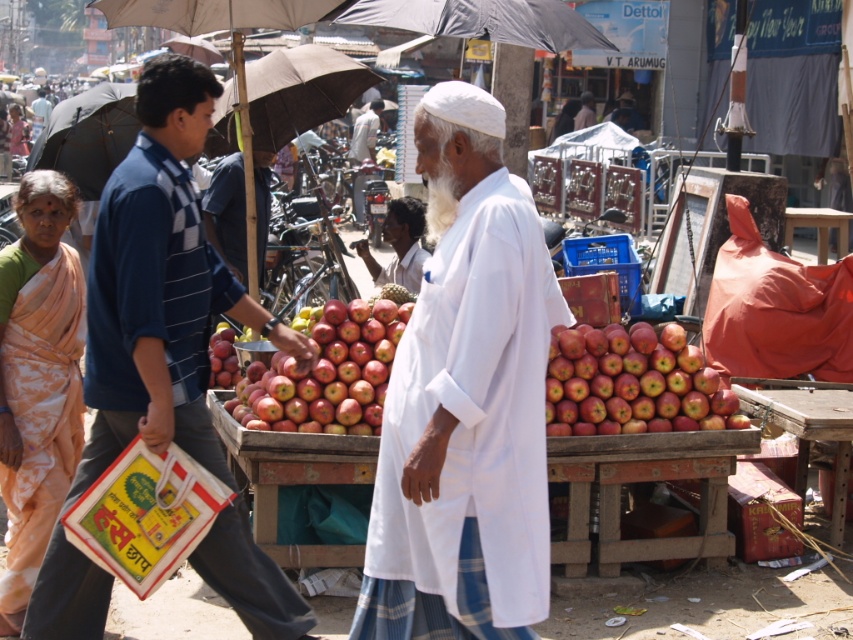
Question: Is red matte apples at center thinner than white cotton shirt at center?

Choices:
 (A) no
 (B) yes

Answer: (A)

Question: Considering the relative positions of red matte apples at center and white cotton shirt at center in the image provided, where is red matte apples at center located with respect to white cotton shirt at center?

Choices:
 (A) left
 (B) right

Answer: (B)

Question: Is white cotton robe at center above matte white apples at center?

Choices:
 (A) no
 (B) yes

Answer: (B)

Question: Among these points, which one is nearest to the camera?

Choices:
 (A) (465, 1)
 (B) (373, 99)
 (C) (142, 131)
 (D) (407, 237)

Answer: (C)

Question: Which of the following is the closest to the observer?

Choices:
 (A) white cotton shirt at center
 (B) dark skin textured face at center
 (C) red matte apples at center

Answer: (C)

Question: Which object appears closest to the camera in this image?

Choices:
 (A) white cotton shirt at center
 (B) dark skin textured face at center
 (C) black matte umbrella at upper center

Answer: (C)